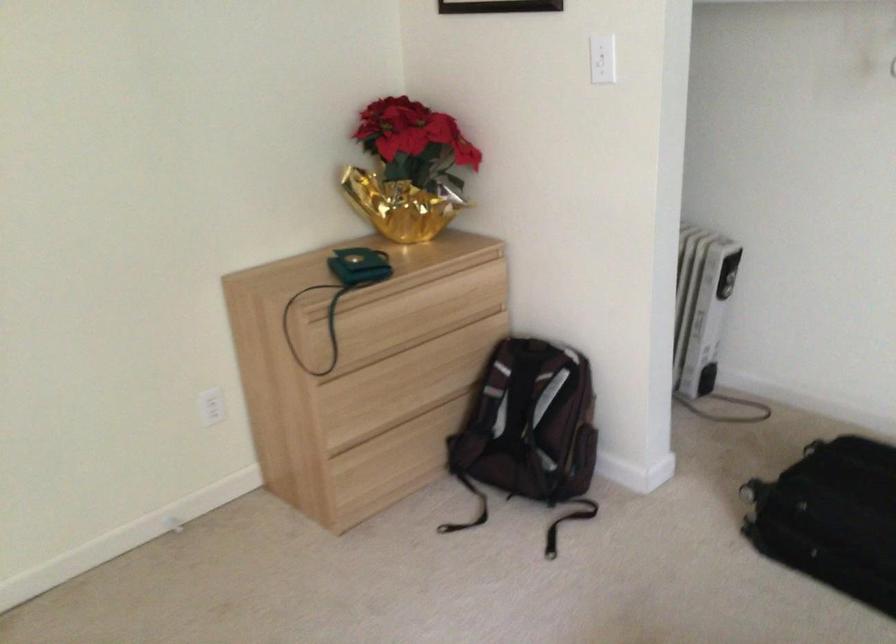
Image resolution: width=896 pixels, height=644 pixels. What do you see at coordinates (602, 59) in the screenshot?
I see `the white light switch` at bounding box center [602, 59].